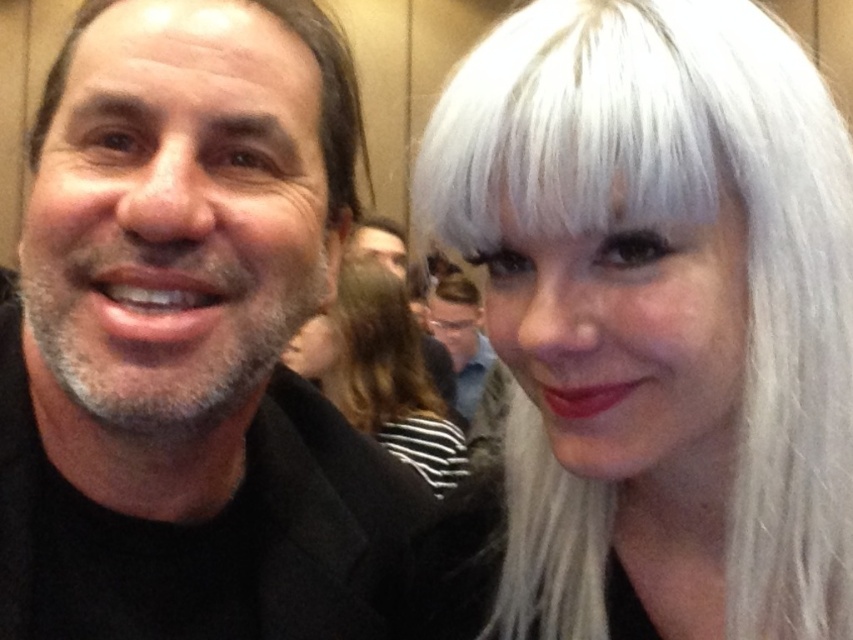
You are a photographer adjusting your camera settings. You notice the gray matte hair at left and the matte black jacket at center in your frame. Which object should you focus on first to ensure both are in sharp focus?

You should focus on the gray matte hair at left first because it is closer to the viewer than the matte black jacket at center, so starting with the closer object ensures depth of field will cover both.

You are a photographer trying to capture a closeup of the white silky hair at right. The camera is currently focused on the point at coordinates point (688, 224). Is the white silky hair at right in focus?

The point (688, 224) marks the white silky hair at right, so yes, the white silky hair at right is in focus.